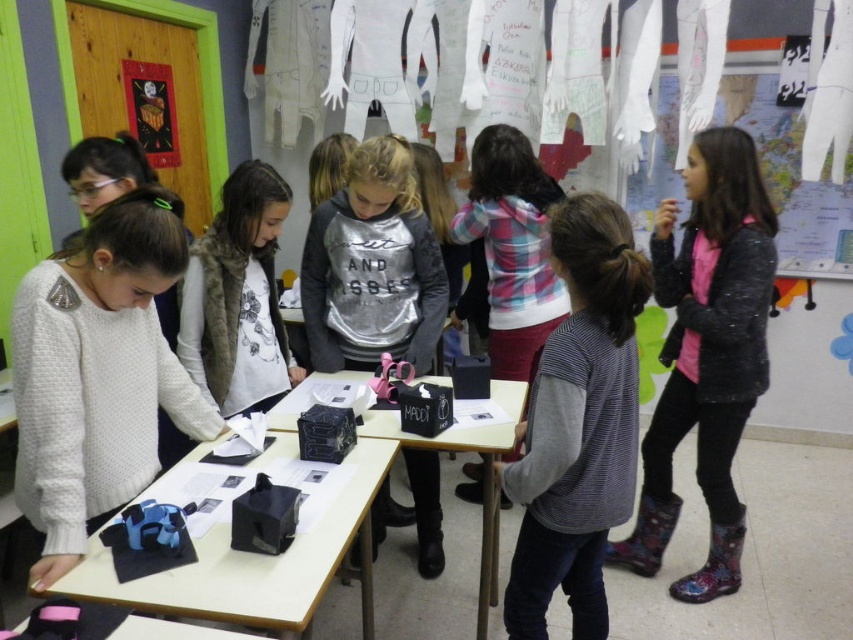
Which is in front, point (740, 234) or point (369, 214)?

Positioned in front is point (740, 234).

Does floral rubber boots at right have a larger size compared to silver metallic sweatshirt at center?

Yes, floral rubber boots at right is bigger than silver metallic sweatshirt at center.

Where is `floral rubber boots at right`? floral rubber boots at right is located at coordinates (706, 355).

Does striped sweater at center have a greater width compared to black plastic table at center?

In fact, striped sweater at center might be narrower than black plastic table at center.

Does striped sweater at center have a lesser height compared to black plastic table at center?

No.

Who is more distant from viewer, (641, 276) or (376, 413)?

Point (376, 413)

Find the location of a particular element. This screenshot has width=853, height=640. striped sweater at center is located at coordinates (578, 422).

The height and width of the screenshot is (640, 853). Describe the element at coordinates (578, 422) in the screenshot. I see `striped sweater at center` at that location.

Does striped sweater at center appear on the right side of black matte paper at center?

Indeed, striped sweater at center is positioned on the right side of black matte paper at center.

Describe the element at coordinates (578, 422) in the screenshot. I see `striped sweater at center` at that location.

At what (x,y) coordinates should I click in order to perform the action: click on striped sweater at center. Please return your answer as a coordinate pair (x, y). Looking at the image, I should click on (578, 422).